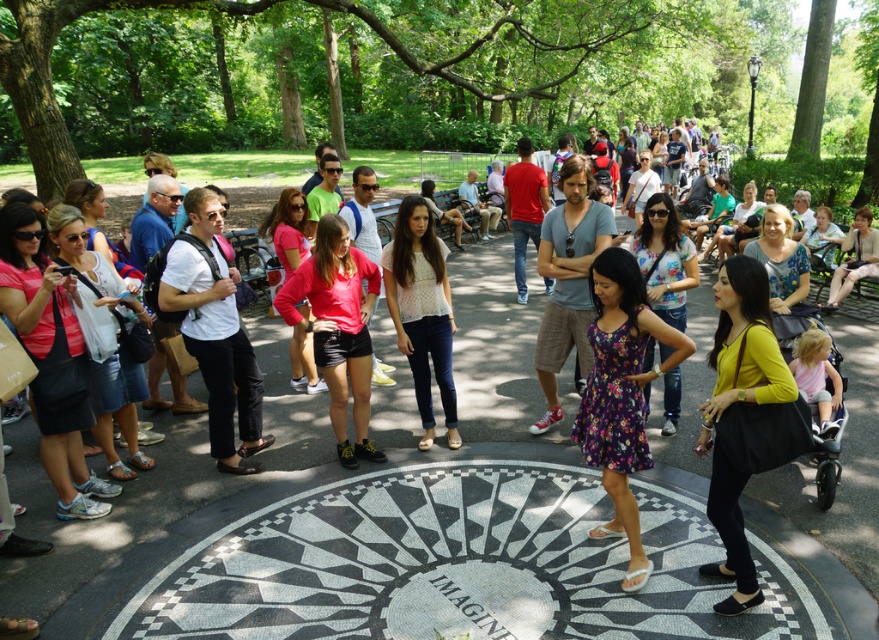
Question: Does light blue cotton shirt at center appear under white lace top at center?

Choices:
 (A) yes
 (B) no

Answer: (B)

Question: Among these objects, which one is farthest from the camera?

Choices:
 (A) white matte shirt at center
 (B) black-and-white mosaic at center
 (C) matte pink shirt at center
 (D) matte yellow blouse at center

Answer: (C)

Question: Among these objects, which one is nearest to the camera?

Choices:
 (A) matte yellow blouse at center
 (B) white matte shirt at center

Answer: (A)

Question: Does black-and-white mosaic at center have a larger size compared to white lace top at center?

Choices:
 (A) yes
 (B) no

Answer: (A)

Question: In this image, where is black-and-white mosaic at center located relative to white matte shirt at center?

Choices:
 (A) left
 (B) right

Answer: (B)

Question: Considering the real-world distances, which object is farthest from the matte yellow blouse at center?

Choices:
 (A) matte pink shirt at center
 (B) light blue cotton shirt at center
 (C) white matte shirt at center

Answer: (C)